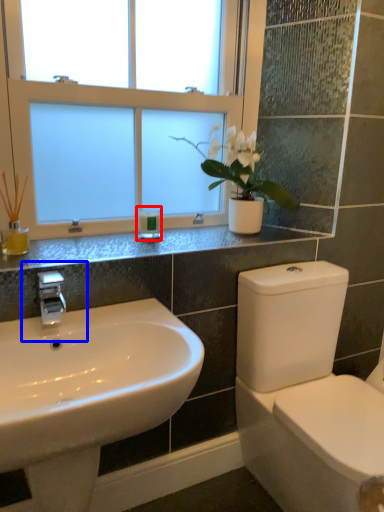
Question: Which object is closer to the camera taking this photo, toiletry (highlighted by a red box) or plumbing fixture (highlighted by a blue box)?

Choices:
 (A) toiletry
 (B) plumbing fixture

Answer: (B)